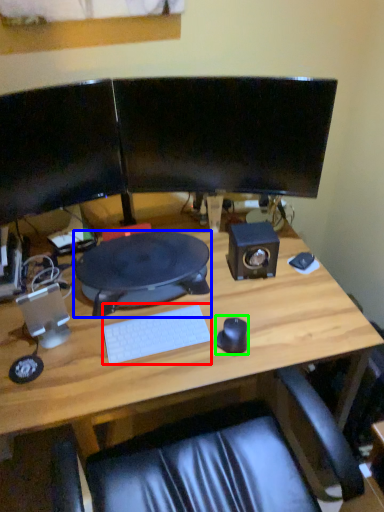
Question: Which is nearer to the computer keyboard (highlighted by a red box)? desktop (highlighted by a blue box) or mouse (highlighted by a green box).

Choices:
 (A) desktop
 (B) mouse

Answer: (B)